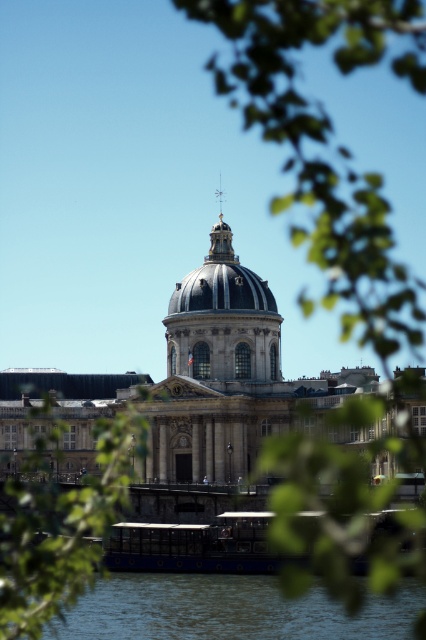
Question: Which point is closer to the camera?

Choices:
 (A) green leafy tree at lower left
 (B) stone dome at center

Answer: (A)

Question: Does stone dome at center come in front of green leafy tree at lower left?

Choices:
 (A) no
 (B) yes

Answer: (A)

Question: Which object is farther from the camera taking this photo?

Choices:
 (A) smooth stone dome at center
 (B) green leafy tree at lower left
 (C) stone dome at center

Answer: (A)

Question: In this image, where is blue water at lower center located relative to smooth stone dome at center?

Choices:
 (A) above
 (B) below

Answer: (B)

Question: Which of the following is the farthest from the observer?

Choices:
 (A) stone dome at center
 (B) blue water at lower center

Answer: (A)

Question: Can you confirm if green leafy tree at upper right is positioned to the left of stone dome at center?

Choices:
 (A) no
 (B) yes

Answer: (A)